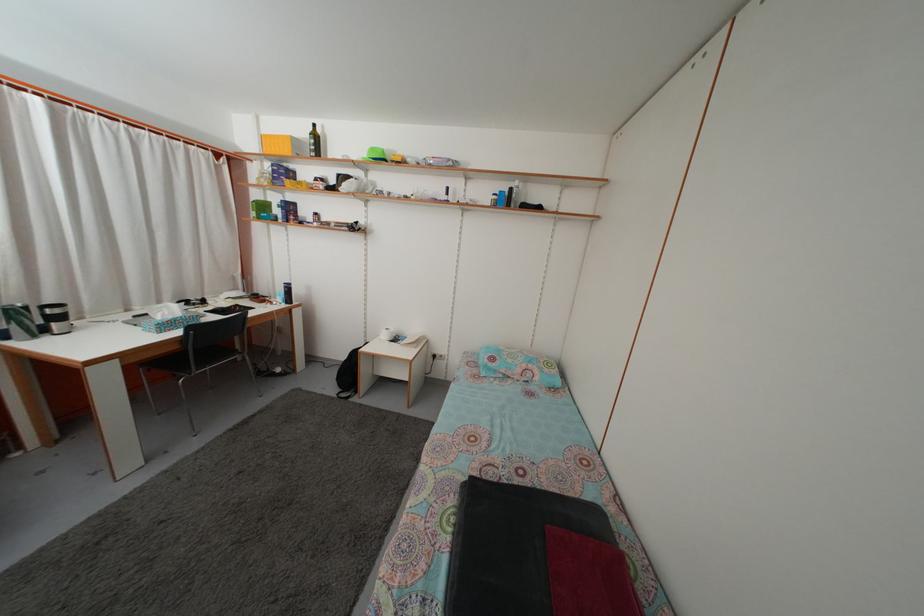
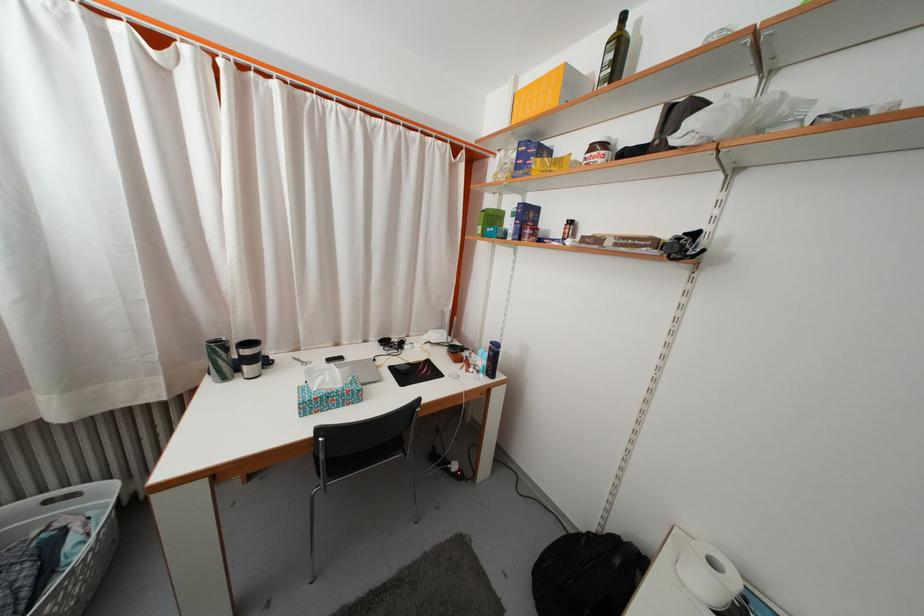
Locate, in the second image, the point that corresponds to [300,148] in the first image.

(575, 84)